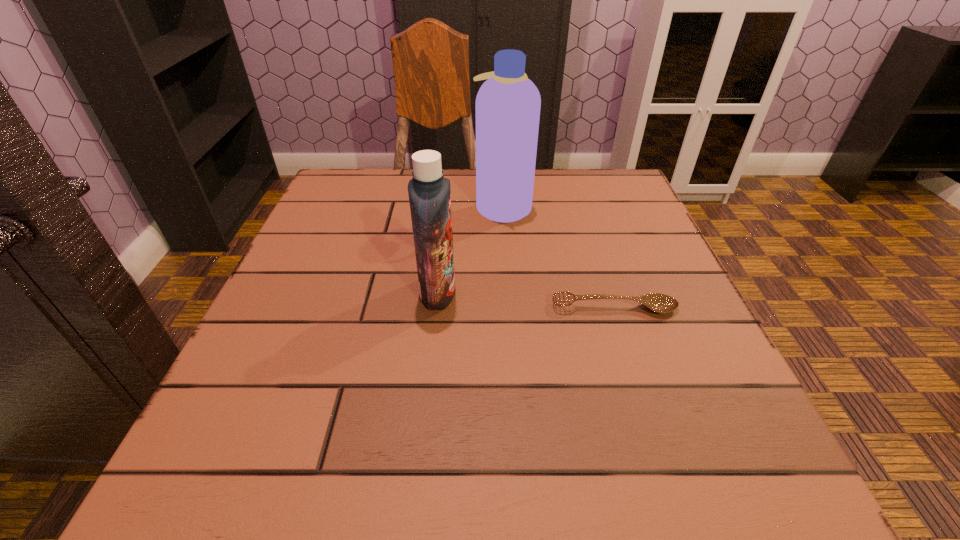
Where is `free space that satisfies the following two spatial constraints: 1. on the front label of the rightmost object; 2. on the left side of the left shampoo`? This screenshot has width=960, height=540. free space that satisfies the following two spatial constraints: 1. on the front label of the rightmost object; 2. on the left side of the left shampoo is located at coordinates coord(436,308).

Locate an element on the screen. vacant space that satisfies the following two spatial constraints: 1. on the front label of the second shortest object; 2. on the left side of the ladle is located at coordinates (436, 308).

Where is `free space that satisfies the following two spatial constraints: 1. on the front side of the taller shampoo; 2. on the left side of the rightmost object`? Image resolution: width=960 pixels, height=540 pixels. free space that satisfies the following two spatial constraints: 1. on the front side of the taller shampoo; 2. on the left side of the rightmost object is located at coordinates (510, 308).

Find the location of a particular element. This screenshot has height=540, width=960. free point that satisfies the following two spatial constraints: 1. on the front label of the nearer shampoo; 2. on the back side of the shortest object is located at coordinates (436, 308).

I want to click on vacant space that satisfies the following two spatial constraints: 1. on the front label of the second tallest object; 2. on the back side of the ladle, so click(436, 308).